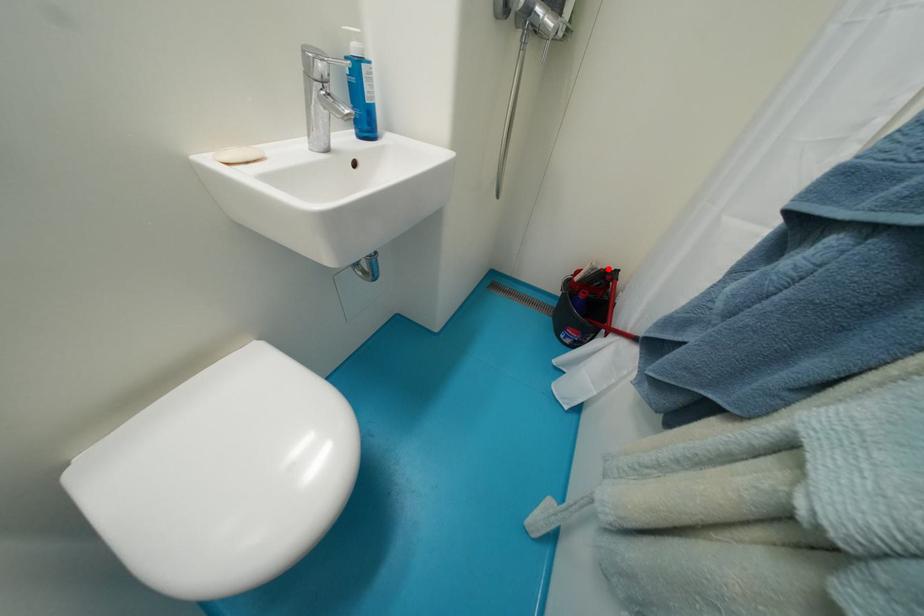
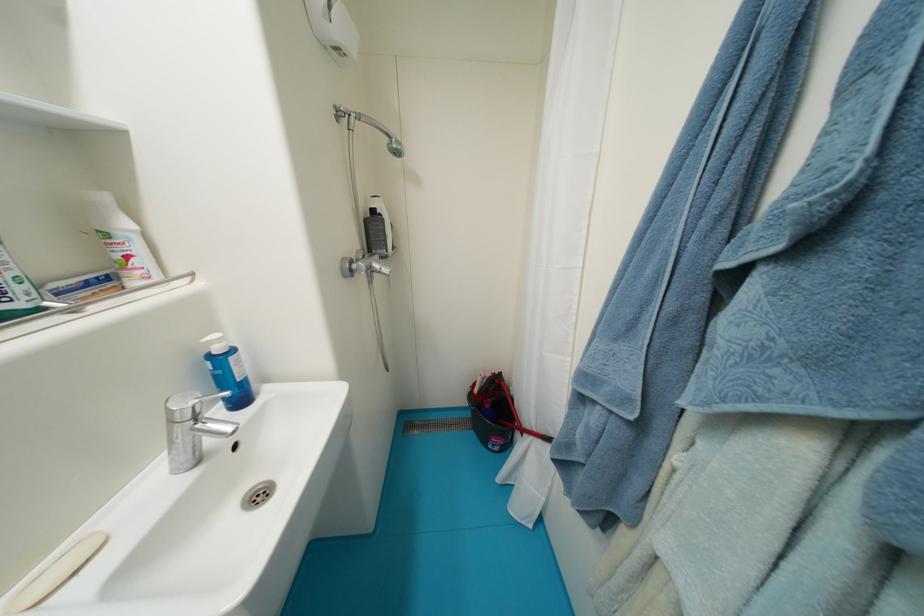
Question: I am providing you with two images of the same scene from different viewpoints. A red point is shown in image1. For the corresponding object point in image2, is it positioned nearer or farther from the camera?

Choices:
 (A) Nearer
 (B) Farther

Answer: (B)